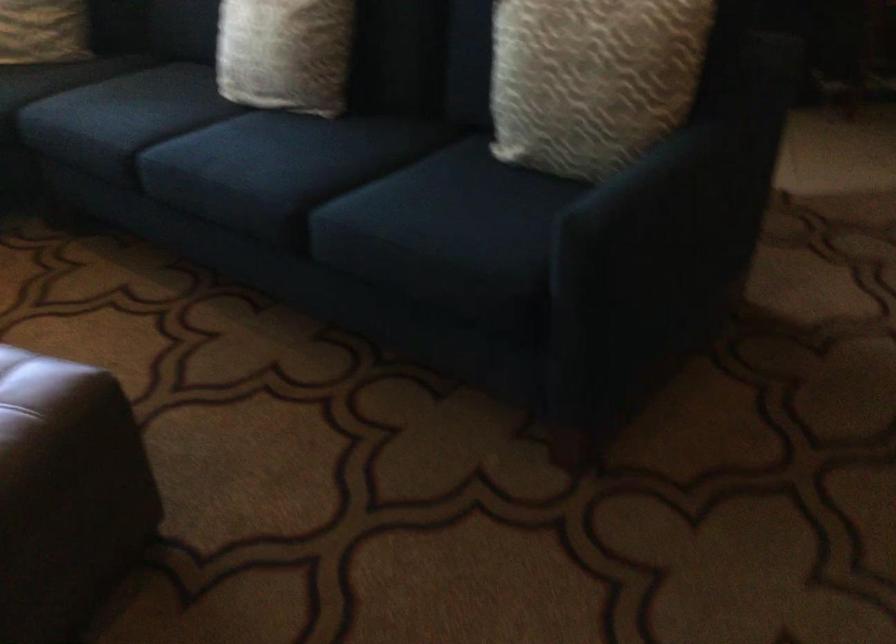
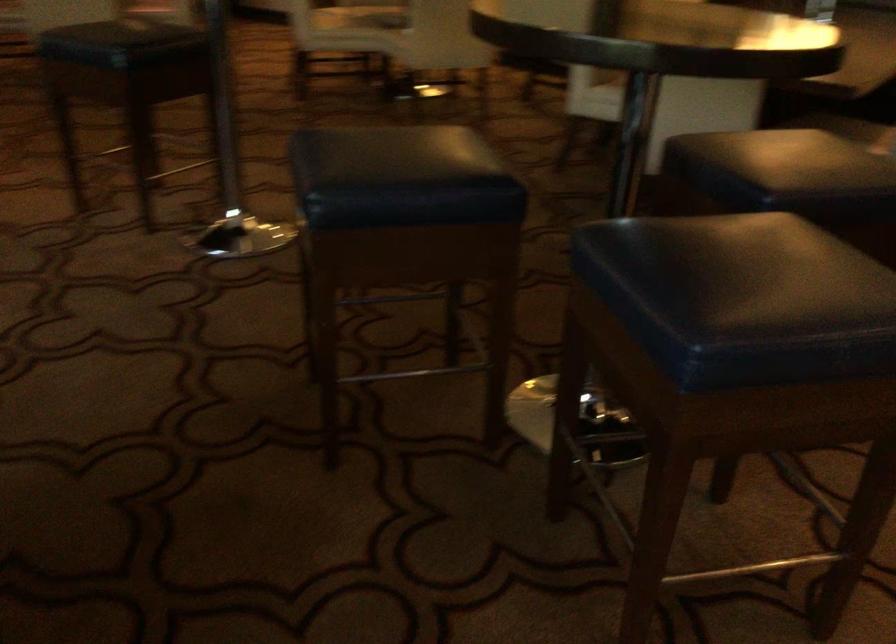
The images are taken continuously from a first-person perspective. In which direction is your viewpoint rotating?

The camera's rotation is toward right-down.